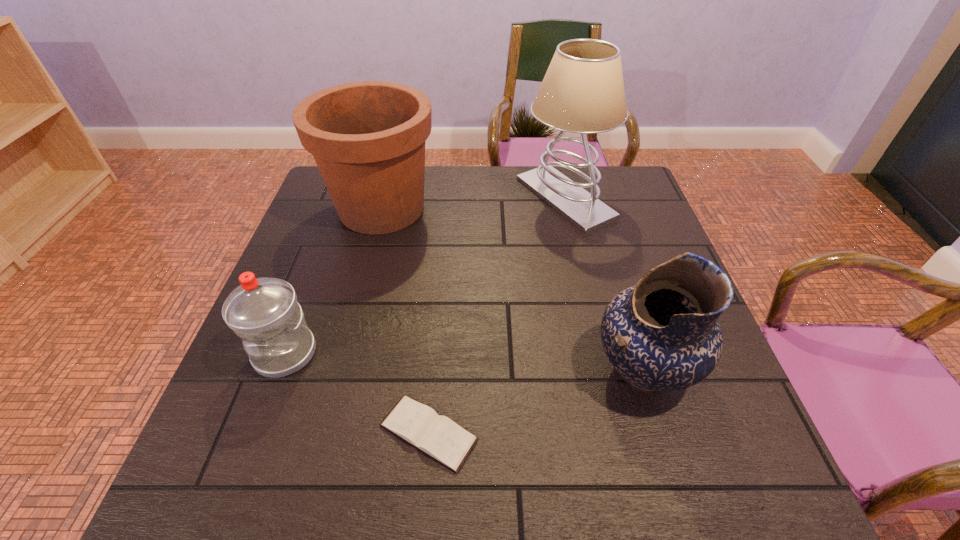
I want to click on table lamp present at the far edge, so 582,92.

At what (x,y) coordinates should I click in order to perform the action: click on flowerpot at the far edge. Please return your answer as a coordinate pair (x, y). The image size is (960, 540). Looking at the image, I should click on (368, 138).

The image size is (960, 540). What are the coordinates of `object positioned at the near edge` in the screenshot? It's located at (439, 437).

Locate an element on the screen. The height and width of the screenshot is (540, 960). flowerpot located at the left edge is located at coordinates (368, 138).

In order to click on water bottle situated at the left edge in this screenshot , I will do click(264, 312).

Find the location of a particular element. Image resolution: width=960 pixels, height=540 pixels. table lamp that is at the right edge is located at coordinates (582, 92).

This screenshot has width=960, height=540. What are the coordinates of `pottery at the right edge` in the screenshot? It's located at (663, 334).

Find the location of a particular element. object positioned at the far left corner is located at coordinates [368, 138].

Identify the location of object situated at the far right corner. (582, 92).

The height and width of the screenshot is (540, 960). I want to click on vacant space at the far edge, so click(x=464, y=172).